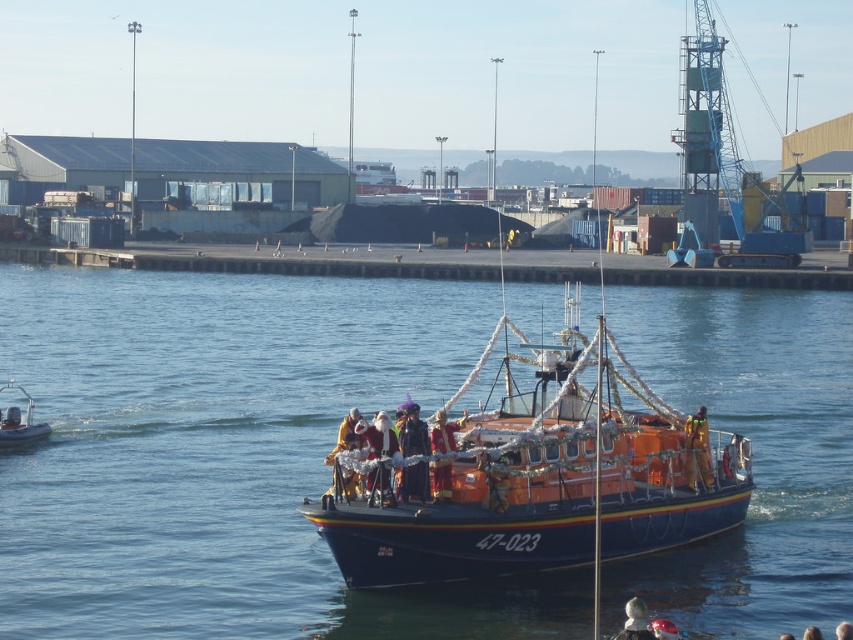
You are standing on the dock and looking at the blue water at center and the santa claus costume at center on the boat. Which object is nearer to you?

The blue water at center is closer to the viewer than the santa claus costume at center, so the blue water at center is nearer.

You are a photographer trying to capture a clear photo of the santa claus costume at center and the orange fiberglass motorboat at left. Which object should you focus on first if you want to ensure both are in focus without adjusting your camera settings?

The orange fiberglass motorboat at left should be focused on first because it is taller than the santa claus costume at center, so focusing on the taller object first allows for a greater depth of field to include both in focus.

You are a photographer on the shore observing the orange fiberglass motorboat at left and the shiny gold costume at center. Which object is closer to the water surface?

The shiny gold costume at center is located below the orange fiberglass motorboat at left, meaning it is closer to the water surface.